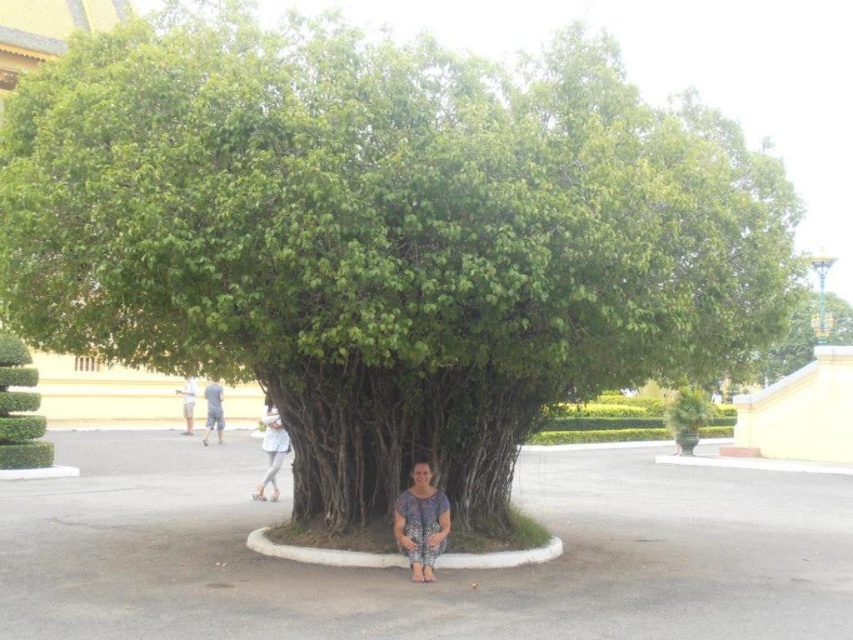
Is printed fabric squat at center thinner than white cotton shirt at center?

Yes, printed fabric squat at center is thinner than white cotton shirt at center.

Which is below, printed fabric squat at center or white cotton shirt at center?

white cotton shirt at center is below.

Who is more distant from viewer, [428,561] or [267,401]?

Point [267,401]

Where is `printed fabric squat at center`? This screenshot has width=853, height=640. printed fabric squat at center is located at coordinates (421, 522).

In the scene shown: Between white cotton shirt at center and gray fabric squat at center, which one is positioned higher?

Positioned higher is gray fabric squat at center.

From the picture: Is the position of white cotton shirt at center more distant than that of gray fabric squat at center?

No, white cotton shirt at center is in front of gray fabric squat at center.

Which is in front, point (256, 497) or point (213, 429)?

Point (256, 497) is more forward.

Where is `white cotton shirt at center`? white cotton shirt at center is located at coordinates [x=271, y=451].

Can you confirm if printed fabric squat at center is positioned to the left of gray fabric squat at center?

No, printed fabric squat at center is not to the left of gray fabric squat at center.

Does printed fabric squat at center have a greater height compared to gray fabric squat at center?

In fact, printed fabric squat at center may be shorter than gray fabric squat at center.

Who is more forward, [416,465] or [219,435]?

Positioned in front is point [416,465].

The height and width of the screenshot is (640, 853). Identify the location of printed fabric squat at center. (421, 522).